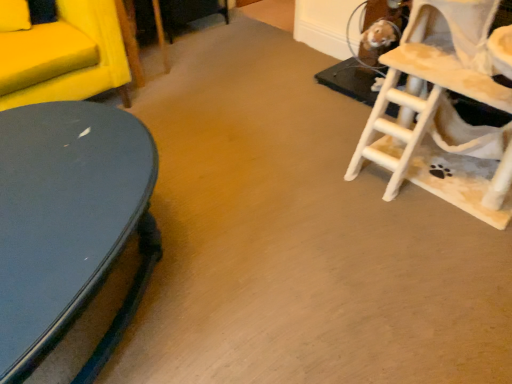
This screenshot has height=384, width=512. What do you see at coordinates (443, 112) in the screenshot?
I see `white wooden ladder at right` at bounding box center [443, 112].

This screenshot has height=384, width=512. Identify the location of white wooden ladder at right. (443, 112).

This screenshot has width=512, height=384. Describe the element at coordinates (71, 236) in the screenshot. I see `glossy dark blue table at left` at that location.

Find the location of a particular element. This screenshot has height=384, width=512. glossy dark blue table at left is located at coordinates (71, 236).

Based on the photo, what is the approximate height of glossy dark blue table at left?

The height of glossy dark blue table at left is 16.88 inches.

Locate an element on the screen. This screenshot has width=512, height=384. white wooden ladder at right is located at coordinates (443, 112).

Would you say glossy dark blue table at left is to the left or to the right of white wooden ladder at right in the picture?

Based on their positions, glossy dark blue table at left is located to the left of white wooden ladder at right.

Does glossy dark blue table at left lie in front of white wooden ladder at right?

That is True.

Does point (50, 271) appear closer or farther from the camera than point (408, 157)?

Point (50, 271) is positioned closer to the camera compared to point (408, 157).

From the image's perspective, relative to white wooden ladder at right, is glossy dark blue table at left above or below?

Based on their image positions, glossy dark blue table at left is located beneath white wooden ladder at right.

From a real-world perspective, relative to white wooden ladder at right, is glossy dark blue table at left vertically above or below?

In terms of real-world spatial position, glossy dark blue table at left is below white wooden ladder at right.

Is glossy dark blue table at left wider than white wooden ladder at right?

Correct, the width of glossy dark blue table at left exceeds that of white wooden ladder at right.

Does glossy dark blue table at left have a lesser height compared to white wooden ladder at right?

Indeed, glossy dark blue table at left has a lesser height compared to white wooden ladder at right.

Between glossy dark blue table at left and white wooden ladder at right, which one has larger size?

With larger size is white wooden ladder at right.

Would you say glossy dark blue table at left is inside or outside white wooden ladder at right?

glossy dark blue table at left cannot be found inside white wooden ladder at right.

Is glossy dark blue table at left far away from white wooden ladder at right?

Absolutely, glossy dark blue table at left is distant from white wooden ladder at right.

In the scene shown: Is glossy dark blue table at left looking in the opposite direction of white wooden ladder at right?

No, glossy dark blue table at left's orientation is not away from white wooden ladder at right.

What's the angular difference between glossy dark blue table at left and white wooden ladder at right's facing directions?

121 degrees separate the facing orientations of glossy dark blue table at left and white wooden ladder at right.

Measure the distance between glossy dark blue table at left and white wooden ladder at right.

glossy dark blue table at left is 1.14 meters away from white wooden ladder at right.

Identify the location of rocking chair that is above the glossy dark blue table at left (from the image's perspective). The width and height of the screenshot is (512, 384). pyautogui.click(x=443, y=112).

Is white wooden ladder at right to the left of glossy dark blue table at left from the viewer's perspective?

Incorrect, white wooden ladder at right is not on the left side of glossy dark blue table at left.

In the scene shown: Is white wooden ladder at right in front of glossy dark blue table at left?

That is False.

Considering the positions of point (413, 148) and point (9, 155), is point (413, 148) closer or farther from the camera than point (9, 155)?

Point (413, 148) is positioned farther from the camera compared to point (9, 155).

From the image's perspective, which object appears higher, white wooden ladder at right or glossy dark blue table at left?

white wooden ladder at right, from the image's perspective.

From a real-world perspective, is white wooden ladder at right over glossy dark blue table at left?

Indeed, from a real-world perspective, white wooden ladder at right stands above glossy dark blue table at left.

Looking at this image, is white wooden ladder at right thinner than glossy dark blue table at left?

Yes, white wooden ladder at right is thinner than glossy dark blue table at left.

Which of these two, white wooden ladder at right or glossy dark blue table at left, stands shorter?

glossy dark blue table at left.

Which of these two, white wooden ladder at right or glossy dark blue table at left, is bigger?

Bigger between the two is white wooden ladder at right.

Is white wooden ladder at right spatially inside glossy dark blue table at left, or outside of it?

white wooden ladder at right lies outside glossy dark blue table at left.

Are white wooden ladder at right and glossy dark blue table at left located far from each other?

white wooden ladder at right is positioned a significant distance from glossy dark blue table at left.

Is white wooden ladder at right turned away from glossy dark blue table at left?

No, glossy dark blue table at left is not at the back of white wooden ladder at right.

How different are the orientations of white wooden ladder at right and glossy dark blue table at left in degrees?

They differ by 121 degrees in their facing directions.

How distant is white wooden ladder at right from glossy dark blue table at left?

white wooden ladder at right is 3.75 feet away from glossy dark blue table at left.

Where is `table located below the white wooden ladder at right (from the image's perspective)`? table located below the white wooden ladder at right (from the image's perspective) is located at coordinates (71, 236).

Identify the location of rocking chair that is behind the glossy dark blue table at left. (443, 112).

Where is `table in front of the white wooden ladder at right`? table in front of the white wooden ladder at right is located at coordinates (71, 236).